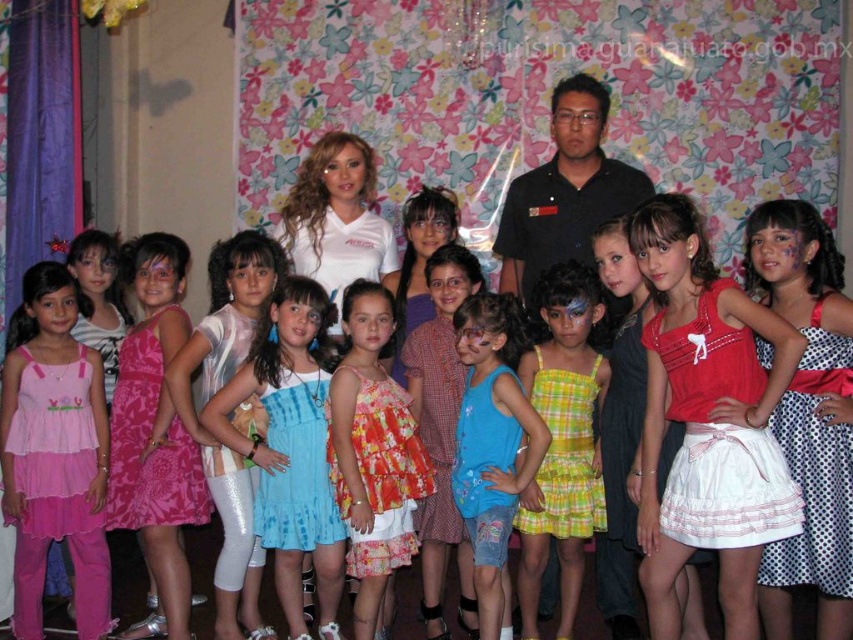
Question: Considering the relative positions of pink satin dress at center and blue tie-dye dress at center in the image provided, where is pink satin dress at center located with respect to blue tie-dye dress at center?

Choices:
 (A) right
 (B) left

Answer: (B)

Question: Which point is closer to the camera?

Choices:
 (A) (675, 317)
 (B) (254, 499)
 (C) (498, 358)
 (D) (581, 385)

Answer: (A)

Question: Which of the following is the closest to the observer?

Choices:
 (A) (416, 444)
 (B) (77, 416)
 (C) (495, 595)
 (D) (548, 355)

Answer: (C)

Question: Can you confirm if yellow plaid dress at center is positioned above blue fabric dress at center?

Choices:
 (A) yes
 (B) no

Answer: (A)

Question: Which is farther from the floral fabric dress at center?

Choices:
 (A) matte red blouse at center
 (B) blue fabric dress at center

Answer: (A)

Question: Observing the image, what is the correct spatial positioning of matte red blouse at center in reference to blue fabric dress at center?

Choices:
 (A) above
 (B) below

Answer: (A)